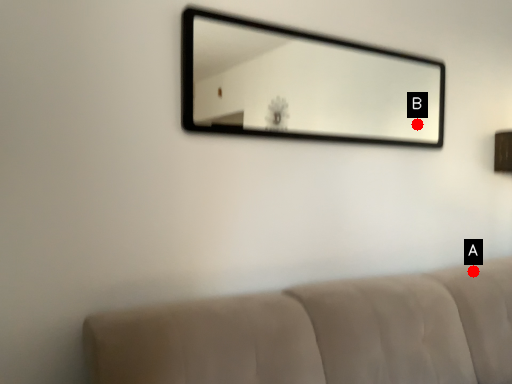
Question: Two points are circled on the image, labeled by A and B beside each circle. Which point appears farthest from the camera in this image?

Choices:
 (A) A is further
 (B) B is further

Answer: (B)